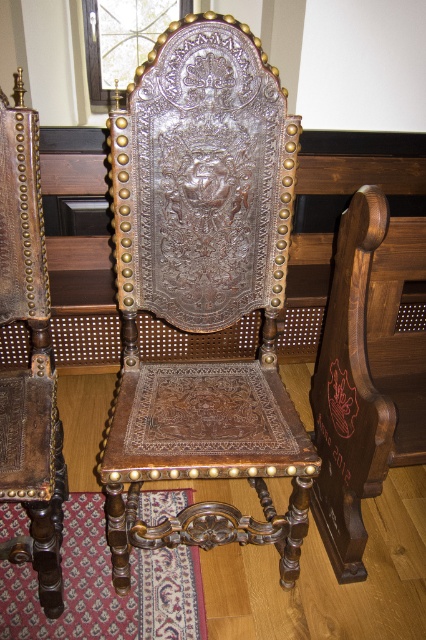
You are standing in a room and want to place a decorative vase that requires a surface 1.2 meters away from you. Can the polished wood armchair at center be used as a surface for the vase?

The polished wood armchair at center is 1.13 meters away from the viewer, which is closer than the required 1.2 meters. Therefore, it cannot be used as a surface for the vase that needs to be placed 1.2 meters away.

Based on the photo, you are an interior designer assessing the placement of furniture in a room. You see the polished wood armchair at center and the leather at left. Which object is located behind the other?

The polished wood armchair at center is positioned over leather at left, meaning it is placed in front of the leather at left.

You are an interior designer assessing the dimensions of furniture in a room. You see the polished wood armchair at center and the leather at left. Which object is wider?

The polished wood armchair at center is wider than the leather at left because the armchair surpasses the leather in width according to the description.